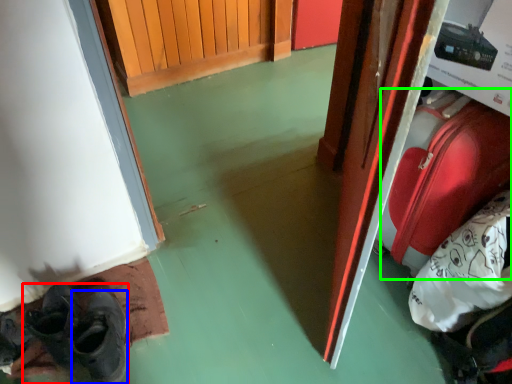
Question: Which object is the closest to the footwear (highlighted by a red box)? Choose among these: shoe (highlighted by a blue box) or luggage (highlighted by a green box).

Choices:
 (A) shoe
 (B) luggage

Answer: (A)